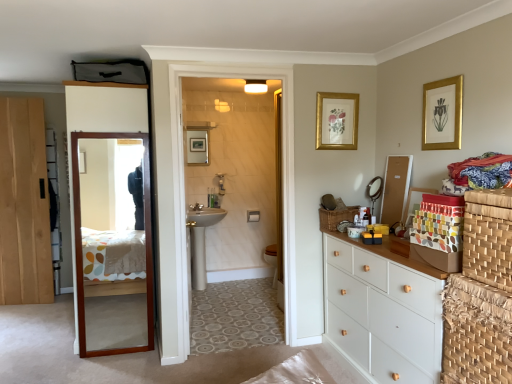
Where is `free point above woven brown basket at right, which is the first basket from back to front (from a real-world perspective)`? The image size is (512, 384). free point above woven brown basket at right, which is the first basket from back to front (from a real-world perspective) is located at coordinates (344, 213).